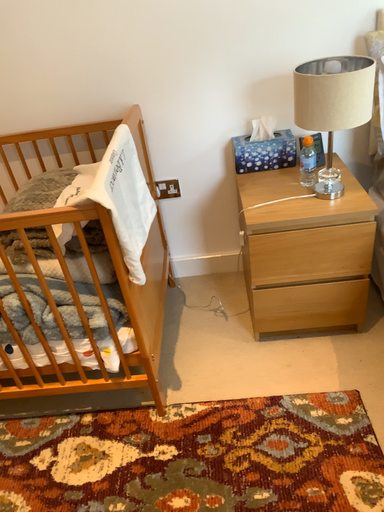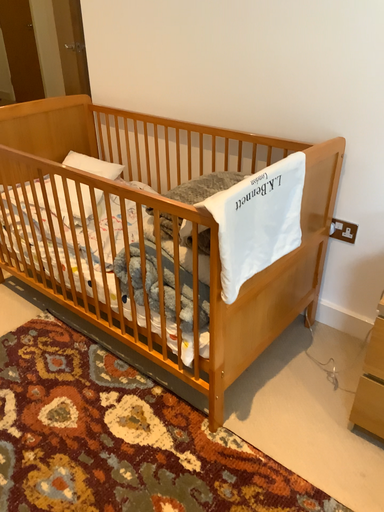
Question: Which way did the camera rotate in the video?

Choices:
 (A) rotated upward
 (B) rotated downward

Answer: (A)